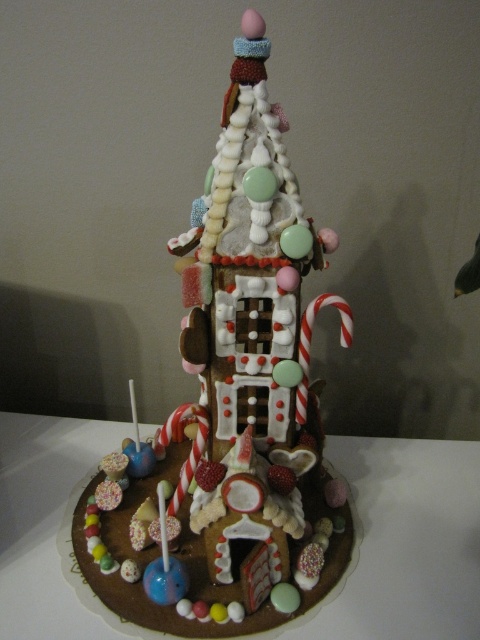
Question: From the image, what is the correct spatial relationship of chocolate candy house at center in relation to chocolate cake at center?

Choices:
 (A) right
 (B) left

Answer: (A)

Question: Among these points, which one is nearest to the camera?

Choices:
 (A) (1, 461)
 (B) (199, 634)

Answer: (B)

Question: Which point is farther to the camera?

Choices:
 (A) chocolate cake at center
 (B) chocolate candy house at center

Answer: (A)

Question: Which point is closer to the camera taking this photo?

Choices:
 (A) (451, 500)
 (B) (278, 564)

Answer: (B)

Question: Can you confirm if chocolate candy house at center is thinner than chocolate cake at center?

Choices:
 (A) no
 (B) yes

Answer: (B)

Question: Considering the relative positions of chocolate candy house at center and chocolate cake at center in the image provided, where is chocolate candy house at center located with respect to chocolate cake at center?

Choices:
 (A) below
 (B) above

Answer: (B)